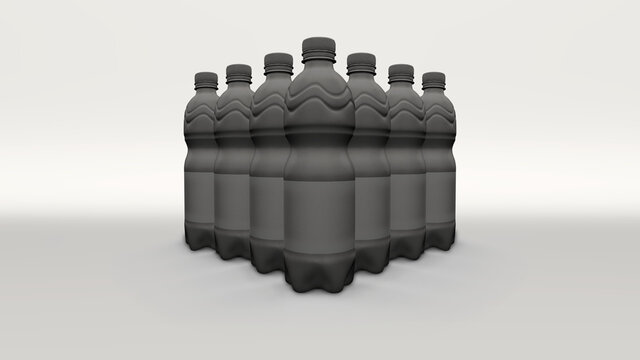
Find the location of a particular element. bottles of soda is located at coordinates (440, 111), (400, 113), (365, 106), (317, 106), (266, 119), (236, 119), (189, 118).